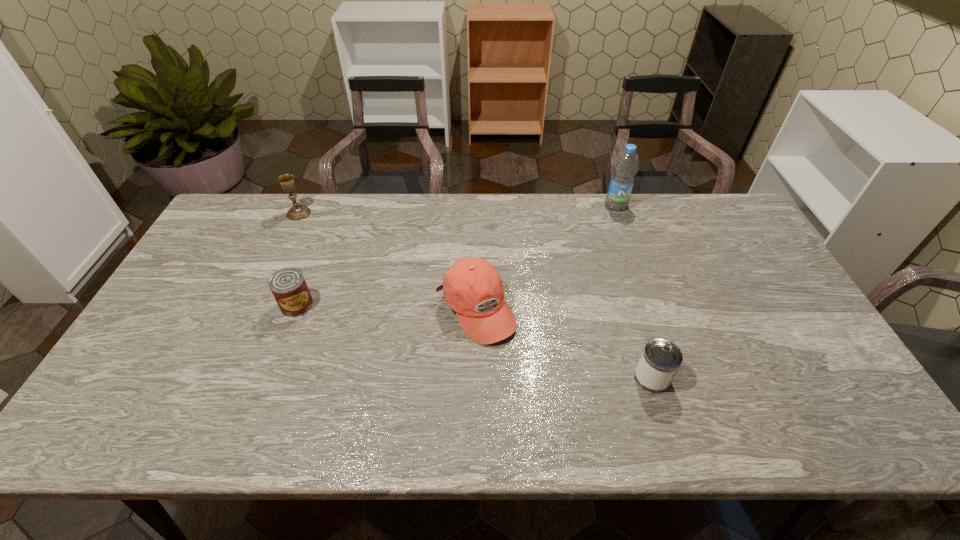
Locate an element on the screen. free space between the chalice and the baseball cap is located at coordinates (387, 261).

At what (x,y) coordinates should I click in order to perform the action: click on vacant area that lies between the water bottle and the second object from left to right. Please return your answer as a coordinate pair (x, y). The image size is (960, 540). Looking at the image, I should click on point(457,255).

Where is `unoccupied area between the nearest object and the baseball cap`? The width and height of the screenshot is (960, 540). unoccupied area between the nearest object and the baseball cap is located at coordinates (564, 343).

Locate an element on the screen. vacant region between the third object from right to left and the right can is located at coordinates (564, 343).

The width and height of the screenshot is (960, 540). In order to click on vacant area that lies between the leftmost object and the farther can in this screenshot , I will do `click(298, 259)`.

I want to click on free space between the third object from left to right and the farther can, so click(386, 307).

At what (x,y) coordinates should I click in order to perform the action: click on unoccupied area between the leftmost object and the second object from left to right. Please return your answer as a coordinate pair (x, y). The height and width of the screenshot is (540, 960). Looking at the image, I should click on 298,259.

Locate an element on the screen. This screenshot has width=960, height=540. vacant space in between the baseball cap and the left can is located at coordinates (386, 307).

Point out which object is positioned as the second nearest to the tallest object. Please provide its 2D coordinates. Your answer should be formatted as a tuple, i.e. [(x, y)], where the tuple contains the x and y coordinates of a point satisfying the conditions above.

[(661, 359)]

Point out which object is positioned as the second nearest to the nearest object. Please provide its 2D coordinates. Your answer should be formatted as a tuple, i.e. [(x, y)], where the tuple contains the x and y coordinates of a point satisfying the conditions above.

[(626, 166)]